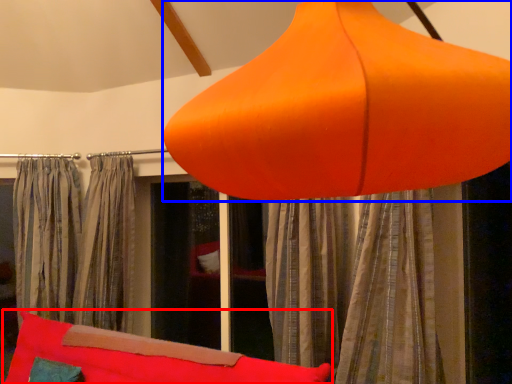
Question: Which object is closer to the camera taking this photo, bean bag chair (highlighted by a red box) or lamp (highlighted by a blue box)?

Choices:
 (A) bean bag chair
 (B) lamp

Answer: (B)